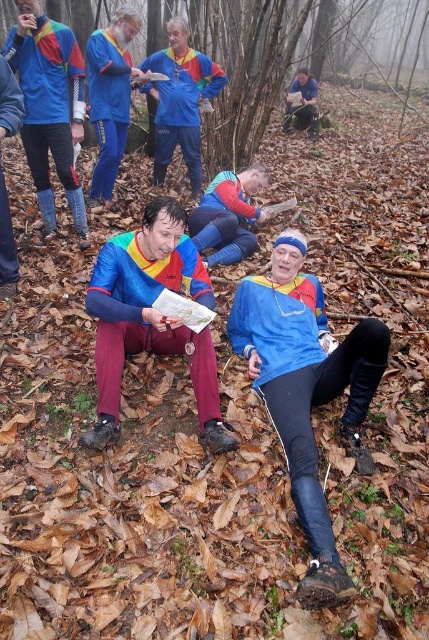
You are part of the orienteering team and need to determine which item is smaller in size between the matte blue jacket at center and the blue fabric map at center. Based on the scene, which one should you choose?

The matte blue jacket at center occupies less space than the blue fabric map at center, so the matte blue jacket at center is the smaller item.

You are part of the orienteering team and need to determine which object at the center of the image is shorter between the matte blue jacket at center and the blue fabric map at center. Based on the scene, which one is shorter?

The matte blue jacket at center is shorter than the blue fabric map at center.